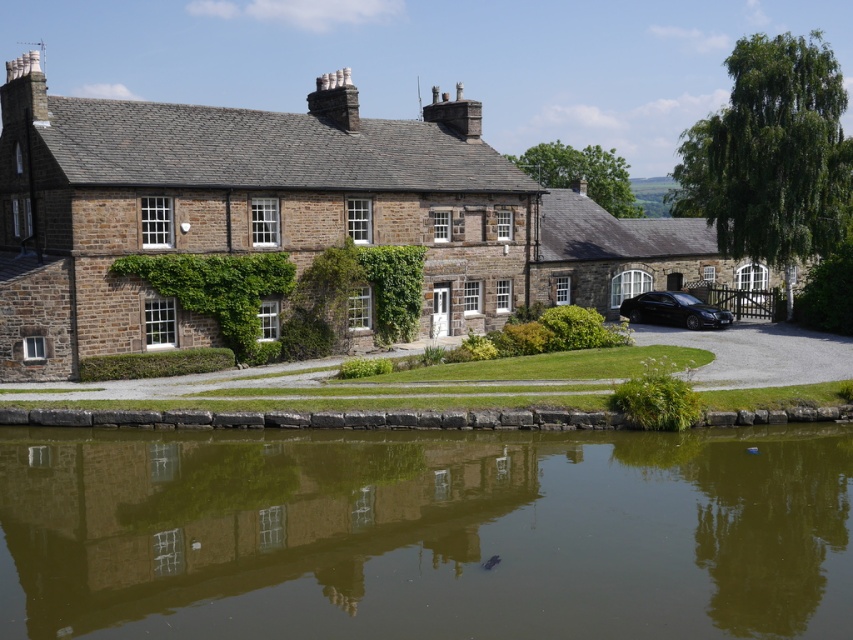
Is point (622, 296) closer to viewer compared to point (653, 316)?

No, it is behind (653, 316).

Can you confirm if matte stone cottage at right is smaller than black glossy sedan at lower right?

Incorrect, matte stone cottage at right is not smaller in size than black glossy sedan at lower right.

Where is `matte stone cottage at right`? matte stone cottage at right is located at coordinates (625, 253).

Where is `matte stone cottage at right`? matte stone cottage at right is located at coordinates (625, 253).

Which of these two, green reflective water at lower center or black glossy sedan at lower right, stands taller?

green reflective water at lower center

Find the location of a particular element. The height and width of the screenshot is (640, 853). green reflective water at lower center is located at coordinates (426, 532).

Identify the location of green reflective water at lower center. The height and width of the screenshot is (640, 853). (426, 532).

Is green reflective water at lower center thinner than matte stone cottage at right?

No.

What do you see at coordinates (426, 532) in the screenshot? The image size is (853, 640). I see `green reflective water at lower center` at bounding box center [426, 532].

Who is more forward, (503, 538) or (645, 288)?

Point (503, 538)

The height and width of the screenshot is (640, 853). I want to click on green reflective water at lower center, so click(426, 532).